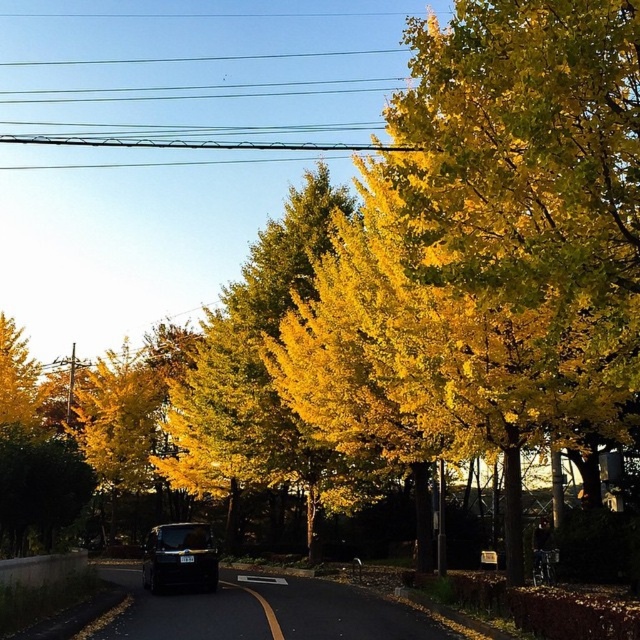
Can you confirm if yellow leafy tree at center is positioned to the left of shiny black van at center?

No, yellow leafy tree at center is not to the left of shiny black van at center.

Can you confirm if yellow leafy tree at center is wider than shiny black van at center?

Correct, the width of yellow leafy tree at center exceeds that of shiny black van at center.

Who is more distant from viewer, (x=301, y=472) or (x=168, y=529)?

The point (x=301, y=472) is behind.

At what (x,y) coordinates should I click in order to perform the action: click on yellow leafy tree at center. Please return your answer as a coordinate pair (x, y). Looking at the image, I should click on (252, 372).